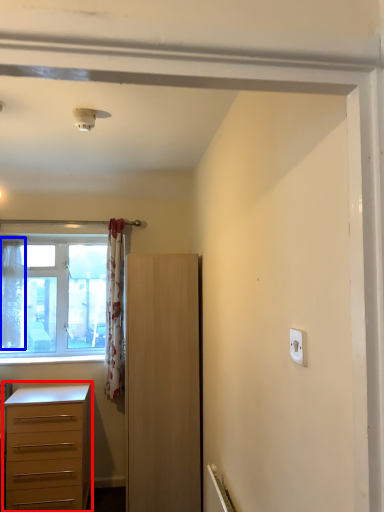
Question: Which object appears farthest to the camera in this image, chest of drawers (highlighted by a red box) or curtain (highlighted by a blue box)?

Choices:
 (A) chest of drawers
 (B) curtain

Answer: (B)